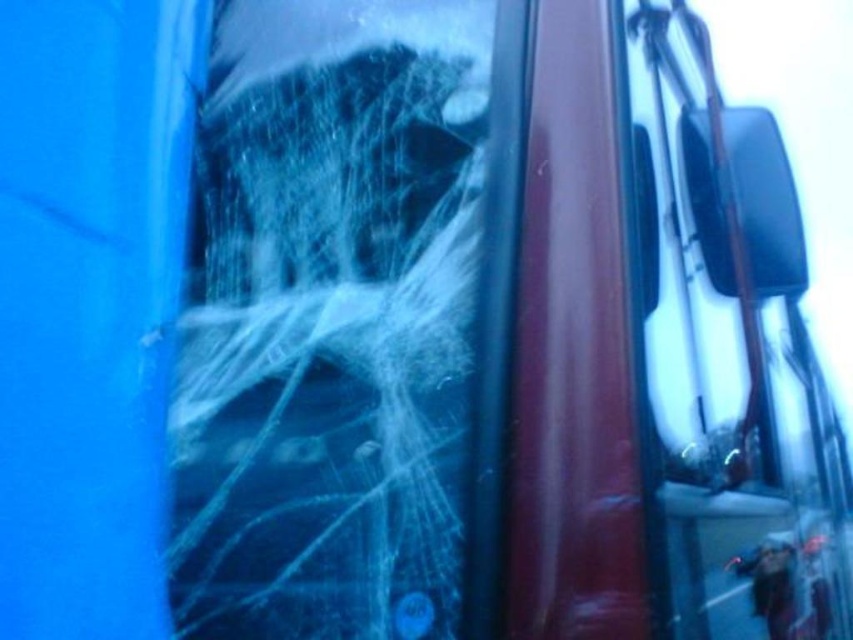
Is white fibrous spider web at center to the right of transparent glass windshield at right from the viewer's perspective?

No, white fibrous spider web at center is not to the right of transparent glass windshield at right.

Which is above, white fibrous spider web at center or transparent glass windshield at right?

white fibrous spider web at center is higher up.

Measure the distance between white fibrous spider web at center and camera.

A distance of 1.06 meters exists between white fibrous spider web at center and camera.

You are a GUI agent. You are given a task and a screenshot of the screen. Output one action in this format:
    pyautogui.click(x=<x>, y=<y>)
    Task: Click on the white fibrous spider web at center
    This screenshot has width=853, height=640.
    Given the screenshot: What is the action you would take?
    pyautogui.click(x=329, y=321)